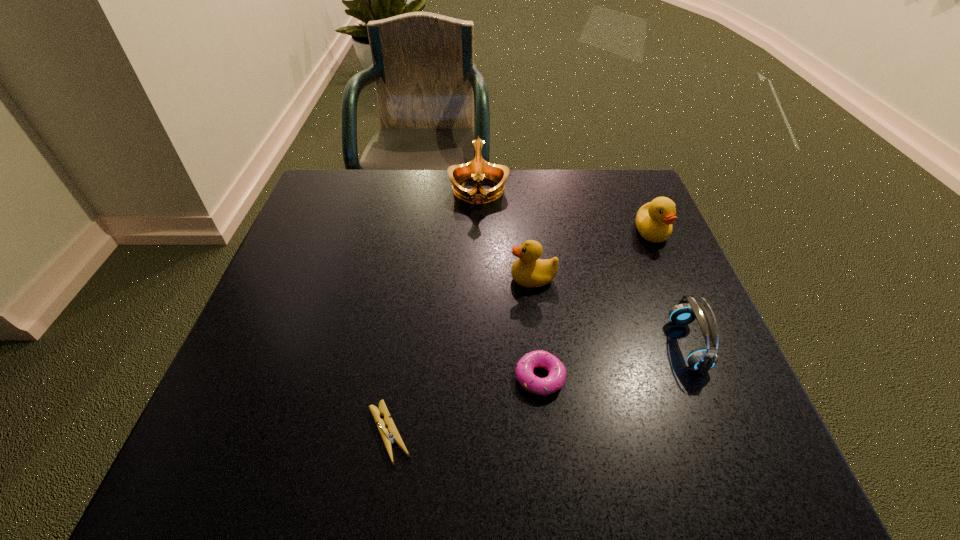
You are a GUI agent. You are given a task and a screenshot of the screen. Output one action in this format:
    pyautogui.click(x=<x>, y=<y>)
    Task: Click on the duck present at the far edge
    The height and width of the screenshot is (540, 960).
    Given the screenshot: What is the action you would take?
    pyautogui.click(x=654, y=220)

Find the location of a particular element. object that is at the near edge is located at coordinates (394, 436).

Where is `duck that is positioned at the right edge`? This screenshot has height=540, width=960. duck that is positioned at the right edge is located at coordinates (654, 220).

Locate an element on the screen. The height and width of the screenshot is (540, 960). headset located in the right edge section of the desktop is located at coordinates (702, 359).

The width and height of the screenshot is (960, 540). Identify the location of object located in the far right corner section of the desktop. (654, 220).

I want to click on free space at the far edge, so point(489,212).

Locate an element on the screen. This screenshot has height=540, width=960. vacant region at the near edge of the desktop is located at coordinates (308, 468).

This screenshot has width=960, height=540. In order to click on free region at the left edge of the desktop in this screenshot , I will do `click(294, 265)`.

The width and height of the screenshot is (960, 540). In the image, there is a desktop. Identify the location of free space at the right edge. (708, 403).

The image size is (960, 540). Identify the location of blank space at the far left corner. (358, 170).